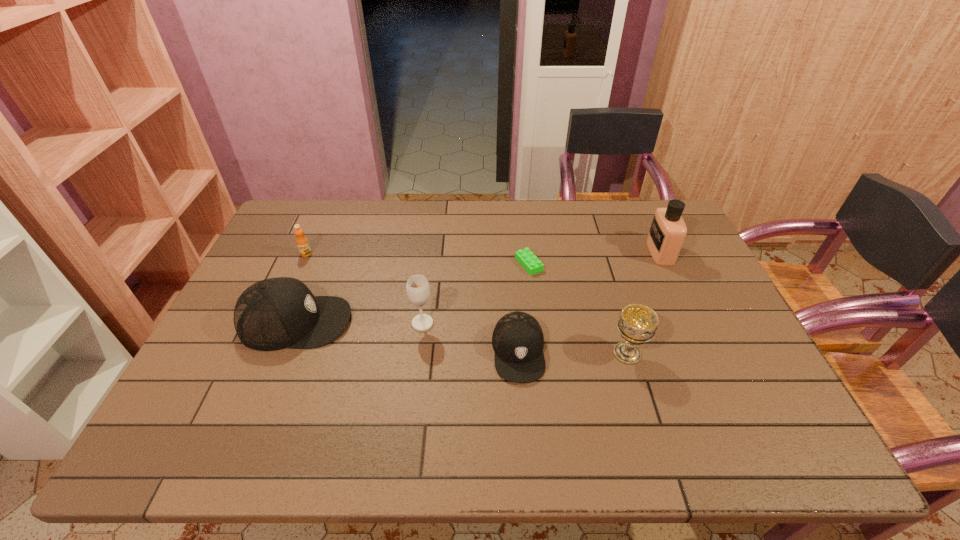
The image size is (960, 540). Find the location of `free space located 0.120m on the front label of the perfume`. free space located 0.120m on the front label of the perfume is located at coordinates (612, 252).

Locate an element on the screen. Image resolution: width=960 pixels, height=540 pixels. free space located 0.170m on the front label of the perfume is located at coordinates (597, 252).

In order to click on blank space located on the front label of the perfume in this screenshot , I will do `click(544, 252)`.

Identify the location of blank area located on the front label of the orange juice. The image size is (960, 540). (300, 270).

At what (x,y) coordinates should I click in order to perform the action: click on vacant space located on the right of the shortest object. Please return your answer as a coordinate pair (x, y). The image size is (960, 540). Looking at the image, I should click on (648, 264).

This screenshot has height=540, width=960. I want to click on vacant region located on the left of the second object from right to left, so click(472, 353).

Where is `free space located on the right of the fifth object from right to left`? This screenshot has width=960, height=540. free space located on the right of the fifth object from right to left is located at coordinates (456, 323).

The height and width of the screenshot is (540, 960). I want to click on object present at the far edge, so click(x=668, y=230).

The width and height of the screenshot is (960, 540). I want to click on object located in the near edge section of the desktop, so click(518, 341).

Find the location of a particular element. This screenshot has width=960, height=540. cap located at the left edge is located at coordinates (275, 313).